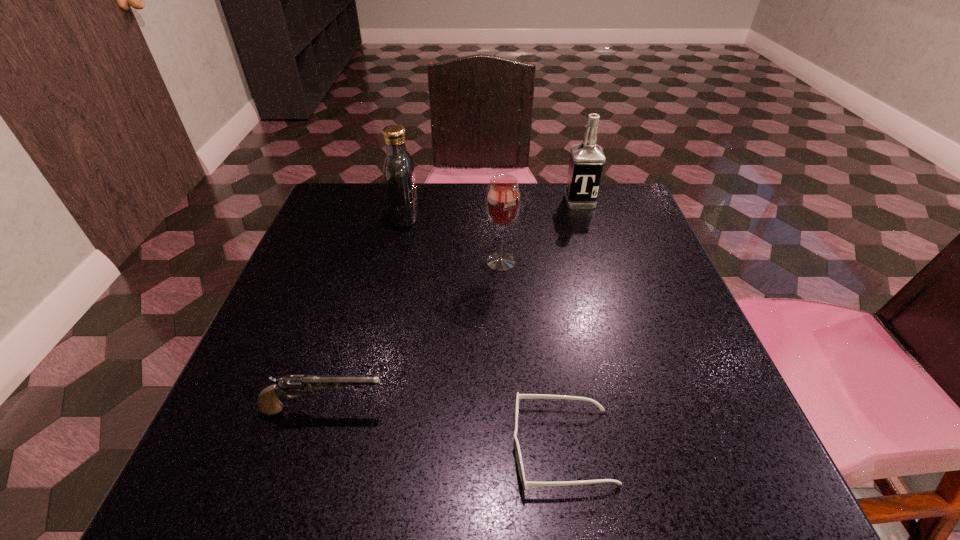
Locate an element on the screen. Image resolution: width=960 pixels, height=540 pixels. vacant space at the far left corner of the desktop is located at coordinates (336, 194).

Identify the location of free region at the near left corner of the desktop. Image resolution: width=960 pixels, height=540 pixels. (305, 475).

Locate an element on the screen. blank space at the far right corner of the desktop is located at coordinates (591, 213).

Where is `free space between the gun and the third nearest object`? The width and height of the screenshot is (960, 540). free space between the gun and the third nearest object is located at coordinates (412, 335).

The image size is (960, 540). Find the location of `free area in between the gun and the rightmost object`. free area in between the gun and the rightmost object is located at coordinates (451, 305).

At what (x,y) coordinates should I click in order to perform the action: click on vacant point located between the sunglasses and the second shortest object. Please return your answer as a coordinate pair (x, y). Looking at the image, I should click on (443, 428).

Locate an element on the screen. Image resolution: width=960 pixels, height=540 pixels. blank region between the shortest object and the right vodka is located at coordinates (571, 324).

Identify the location of vacant area that lies between the wineglass and the rightmost object. This screenshot has width=960, height=540. (540, 232).

This screenshot has height=540, width=960. I want to click on free area in between the gun and the rightmost object, so click(x=451, y=305).

This screenshot has width=960, height=540. I want to click on free space between the left vodka and the second shortest object, so click(364, 313).